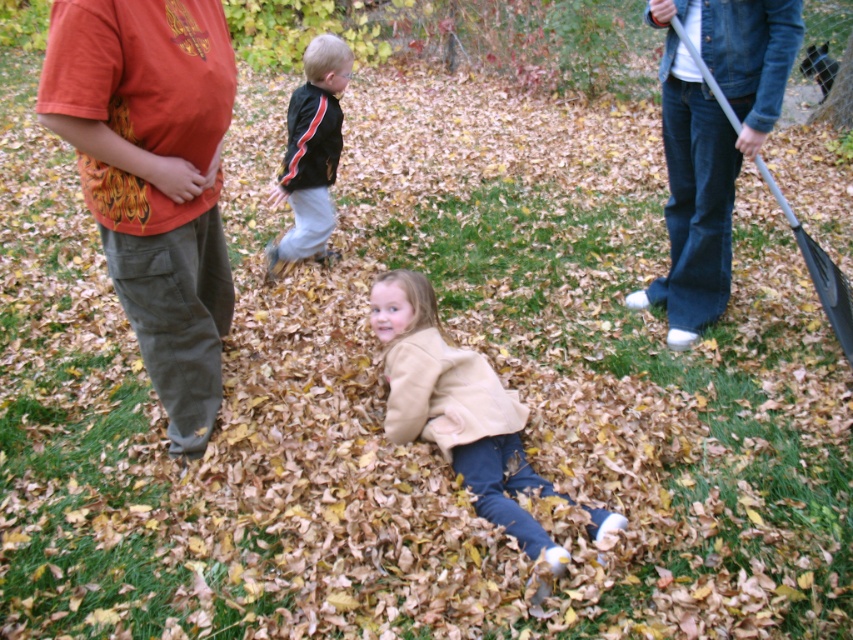
You are a photographer setting up a shot of the two children in the scene. You need to position a small stool between the beige soft coat at center and the black matte jacket at center so that it doesn

The beige soft coat at center has a lesser height compared to black matte jacket at center, so the stool should be placed closer to the beige soft coat at center to ensure both children can comfortably reach it.

You are standing in the autumn backyard scene. There are two points marked in the image. The first point is at coordinates point (309, 246) and the second is at point (682, 33). Which of these two points is closer to you?

Point (309, 246) is closer to you because it is further to the viewer than point (682, 33).